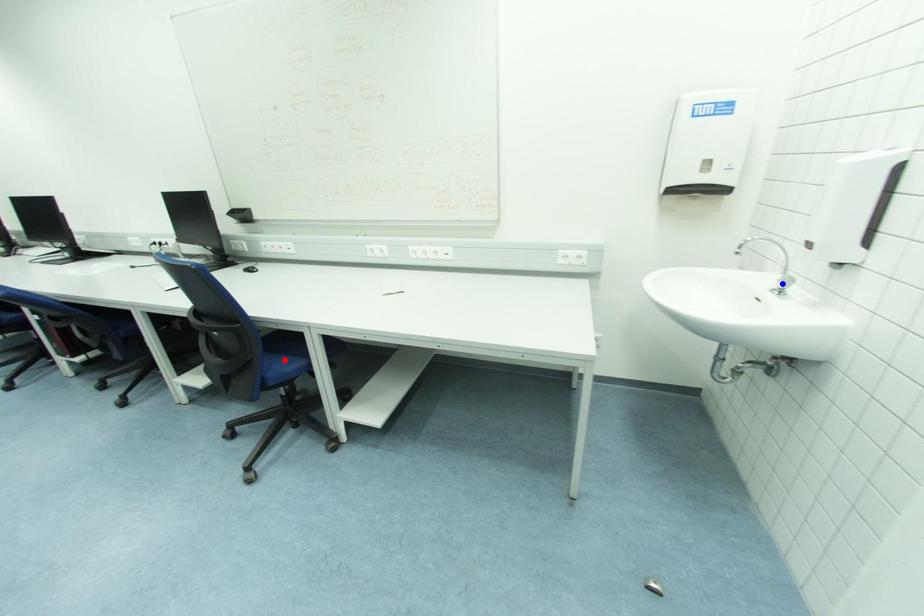
Question: Two points are marked on the image. Which point is closer to the camera?

Choices:
 (A) Blue point is closer.
 (B) Red point is closer.

Answer: (A)